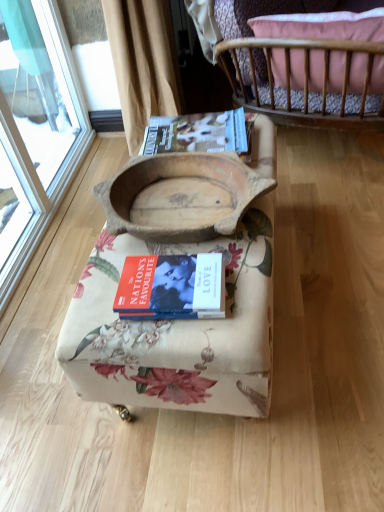
Find the location of a particular element. The image size is (384, 512). unoccupied region to the right of wooden bowl at center, acting as the 1th furniture starting from the bottom is located at coordinates (328, 250).